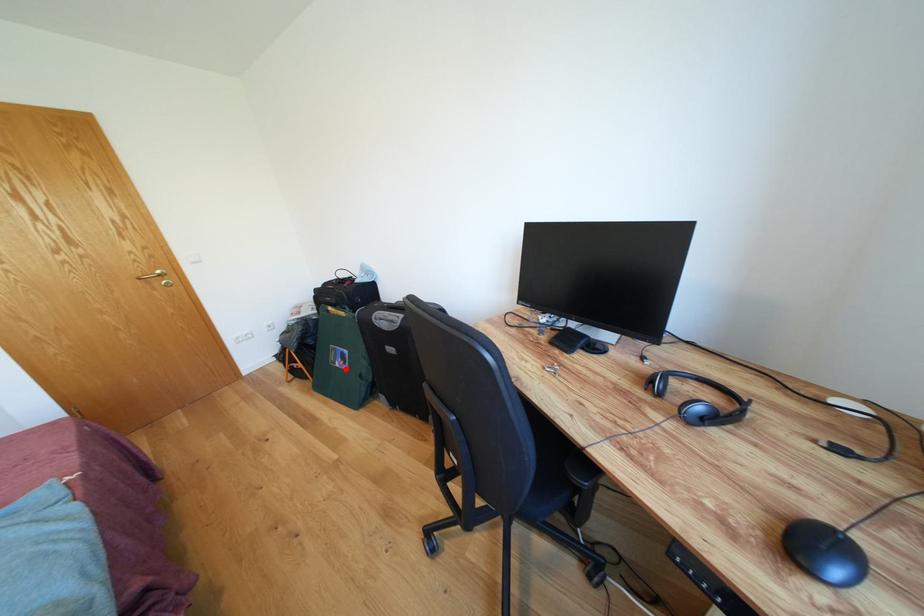
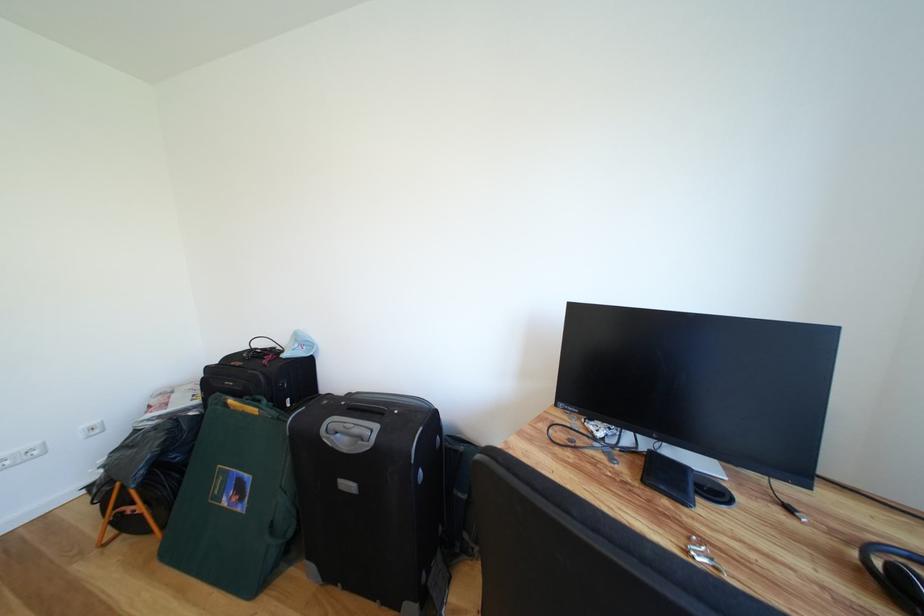
In the second image, find the point that corresponds to the highlighted location in the first image.

(234, 506)